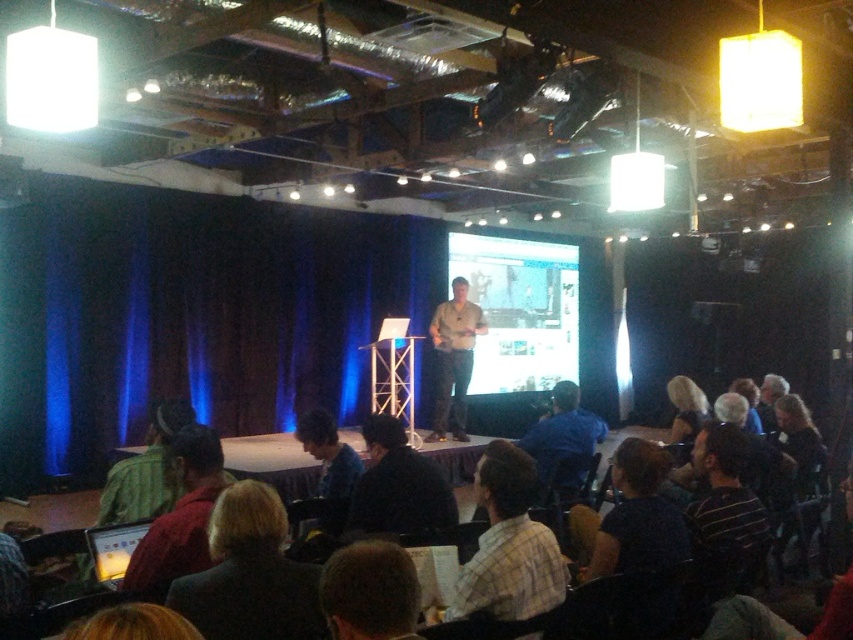
Does blue velvet curtain at left appear over dark brown suit at lower center?

Correct, blue velvet curtain at left is located above dark brown suit at lower center.

Can you confirm if blue velvet curtain at left is smaller than dark brown suit at lower center?

Actually, blue velvet curtain at left might be larger than dark brown suit at lower center.

Image resolution: width=853 pixels, height=640 pixels. Identify the location of blue velvet curtain at left. pyautogui.click(x=189, y=316).

Is dark brown suit at lower center shorter than plaid shirt at center?

Correct, dark brown suit at lower center is not as tall as plaid shirt at center.

Image resolution: width=853 pixels, height=640 pixels. What do you see at coordinates (250, 573) in the screenshot?
I see `dark brown suit at lower center` at bounding box center [250, 573].

This screenshot has height=640, width=853. I want to click on dark brown suit at lower center, so point(250,573).

Which is in front, point (252, 579) or point (589, 428)?

Point (252, 579)

Does dark brown suit at lower center have a larger size compared to blue shirt at center?

No, dark brown suit at lower center is not bigger than blue shirt at center.

Identify the location of dark brown suit at lower center. (250, 573).